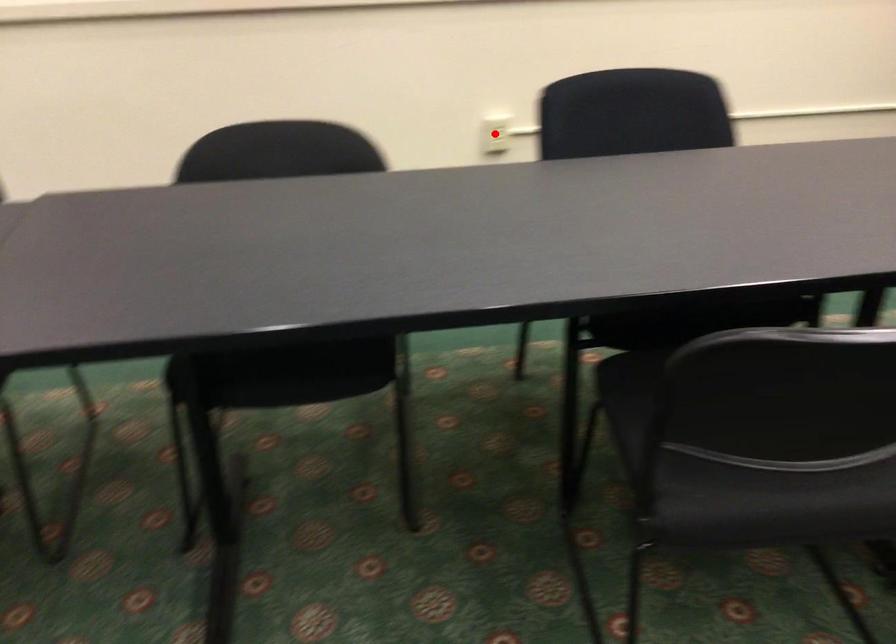
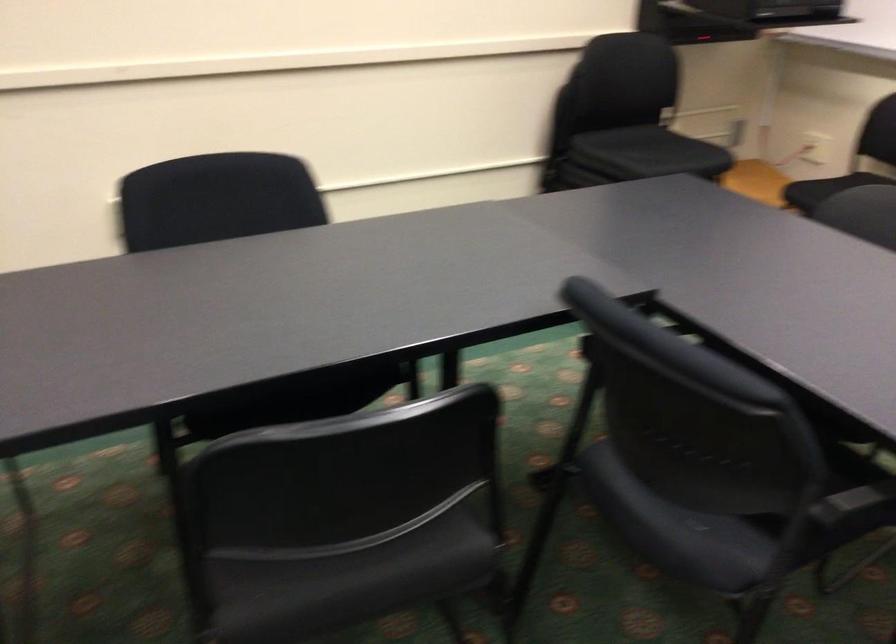
Question: I am providing you with two images of the same scene from different viewpoints. A red point is marked on the first image. Is the red point's position out of view in image 2?

Choices:
 (A) Yes
 (B) No

Answer: (A)